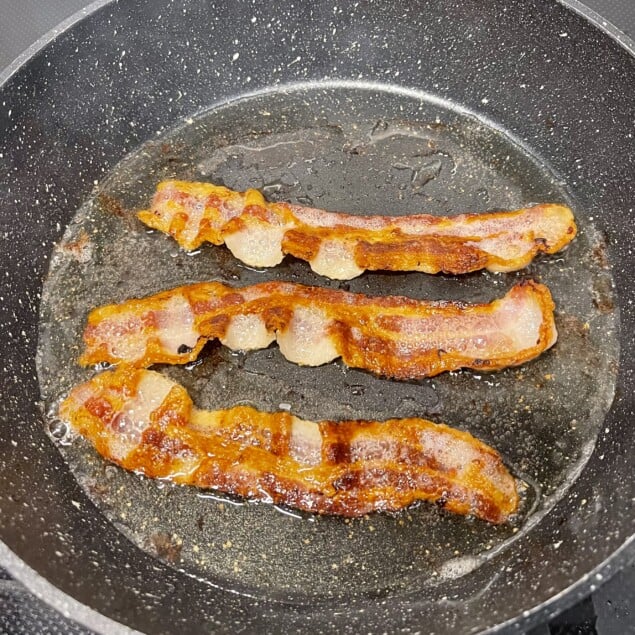
This screenshot has width=635, height=635. Find the location of `outer rim of frying pan`. outer rim of frying pan is located at coordinates (70, 20), (585, 7), (599, 573), (63, 599).